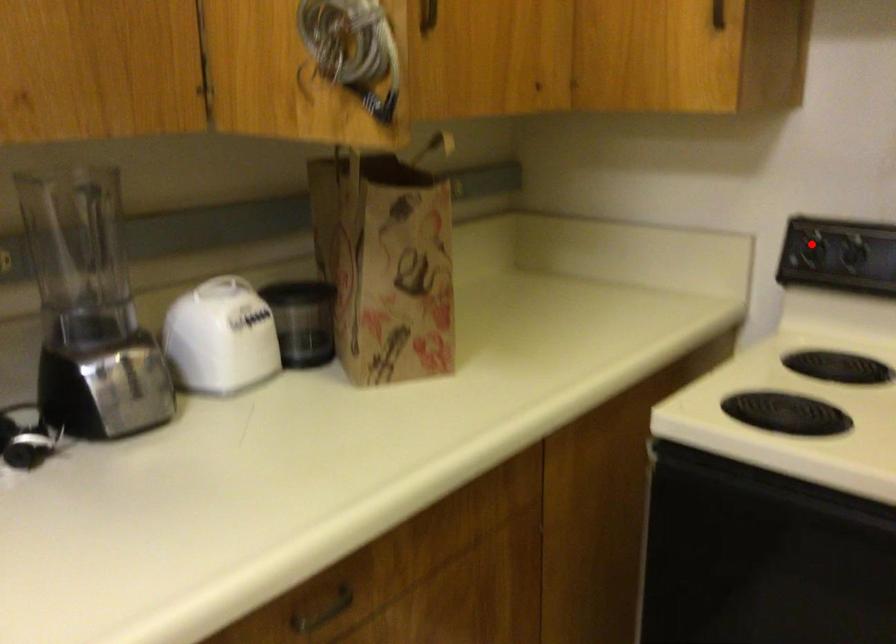
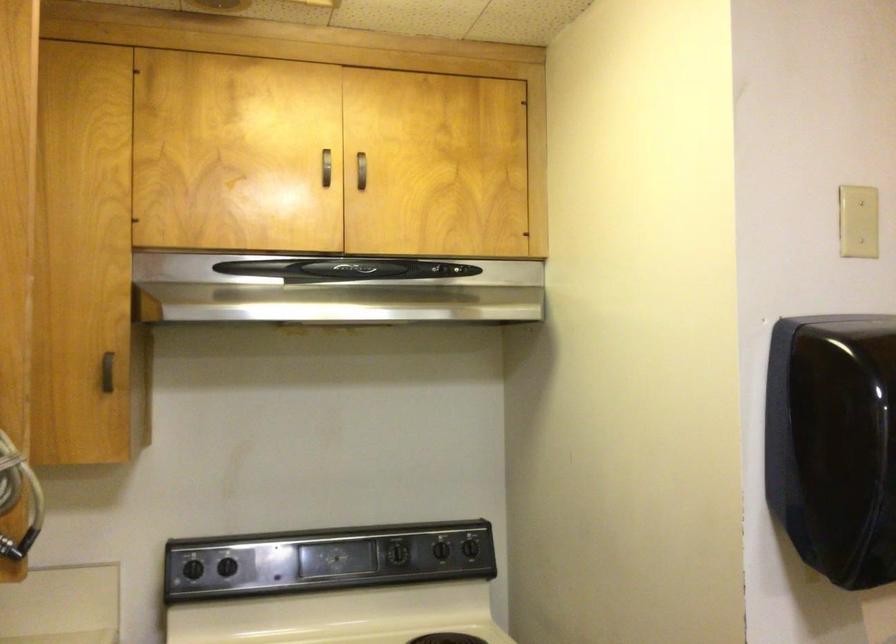
In the second image, find the point that corresponds to the highlighted location in the first image.

(193, 569)